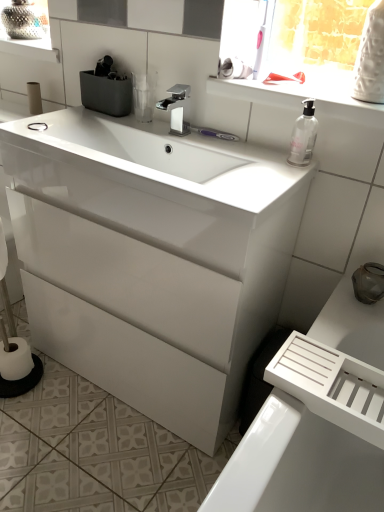
I want to click on blank area to the left of clear glass soap dispenser at upper right, so click(x=249, y=157).